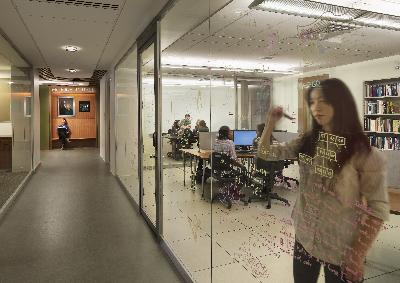
This screenshot has width=400, height=283. Identify the location of light. (341, 14), (76, 70), (70, 47).